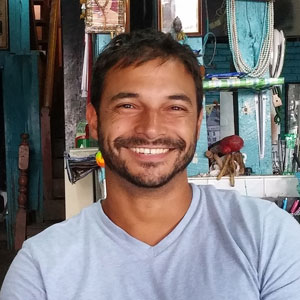
Where is `mirror`? mirror is located at coordinates (191, 18).